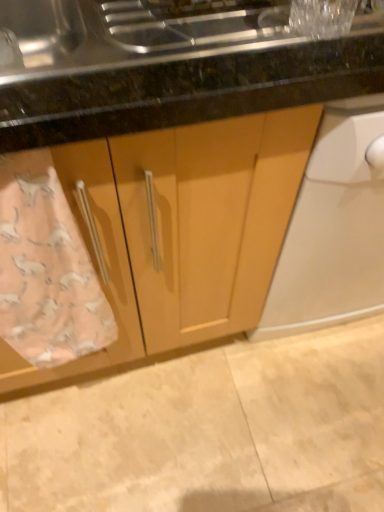
Question: Does pink fabric towel at lower left lie in front of beige tile floor at lower center?

Choices:
 (A) no
 (B) yes

Answer: (B)

Question: From the image's perspective, is pink fabric towel at lower left on beige tile floor at lower center?

Choices:
 (A) no
 (B) yes

Answer: (B)

Question: From a real-world perspective, is pink fabric towel at lower left located beneath beige tile floor at lower center?

Choices:
 (A) no
 (B) yes

Answer: (A)

Question: Does pink fabric towel at lower left have a greater width compared to beige tile floor at lower center?

Choices:
 (A) yes
 (B) no

Answer: (B)

Question: Does pink fabric towel at lower left contain beige tile floor at lower center?

Choices:
 (A) yes
 (B) no

Answer: (B)

Question: From a real-world perspective, is matte wood cabinet at center positioned above or below beige tile floor at lower center?

Choices:
 (A) above
 (B) below

Answer: (A)

Question: Would you say matte wood cabinet at center is to the left or to the right of beige tile floor at lower center in the picture?

Choices:
 (A) right
 (B) left

Answer: (B)

Question: Considering the positions of matte wood cabinet at center and beige tile floor at lower center in the image, is matte wood cabinet at center bigger or smaller than beige tile floor at lower center?

Choices:
 (A) big
 (B) small

Answer: (A)

Question: Is matte wood cabinet at center inside the boundaries of beige tile floor at lower center, or outside?

Choices:
 (A) inside
 (B) outside

Answer: (B)

Question: Does point (86, 503) appear closer or farther from the camera than point (152, 134)?

Choices:
 (A) farther
 (B) closer

Answer: (A)

Question: From a real-world perspective, is beige tile floor at lower center physically located above or below matte wood cabinet at center?

Choices:
 (A) above
 (B) below

Answer: (B)

Question: Based on their sizes in the image, would you say beige tile floor at lower center is bigger or smaller than matte wood cabinet at center?

Choices:
 (A) small
 (B) big

Answer: (A)

Question: Considering their positions, is beige tile floor at lower center located in front of or behind matte wood cabinet at center?

Choices:
 (A) front
 (B) behind

Answer: (B)

Question: Is point (200, 324) positioned closer to the camera than point (38, 222)?

Choices:
 (A) closer
 (B) farther

Answer: (B)

Question: From a real-world perspective, is matte wood cabinet at center above or below pink fabric towel at lower left?

Choices:
 (A) above
 (B) below

Answer: (B)